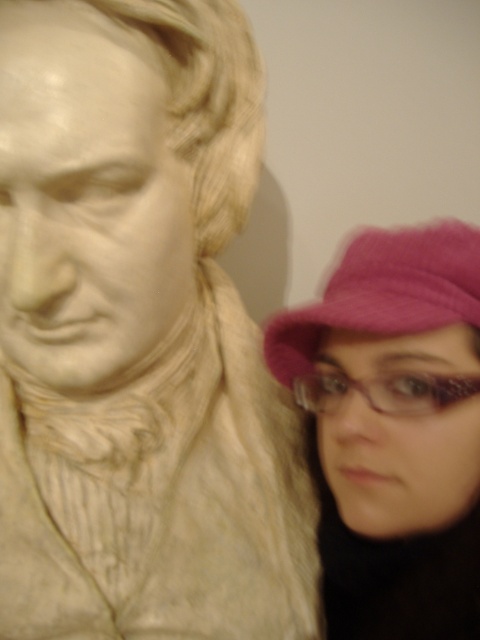
Question: Does white marble bust at upper left lie behind pink fuzzy hat at lower right?

Choices:
 (A) yes
 (B) no

Answer: (B)

Question: Considering the relative positions of pink fuzzy hat at right and pink fuzzy hat at lower right in the image provided, where is pink fuzzy hat at right located with respect to pink fuzzy hat at lower right?

Choices:
 (A) below
 (B) above

Answer: (A)

Question: Can you confirm if white marble bust at upper left is wider than pink fuzzy hat at right?

Choices:
 (A) no
 (B) yes

Answer: (B)

Question: Which object is closer to the camera taking this photo?

Choices:
 (A) pink fuzzy hat at lower right
 (B) pink fuzzy hat at right

Answer: (A)

Question: Which object is positioned farthest from the pink fuzzy hat at right?

Choices:
 (A) white marble bust at upper left
 (B) pink fuzzy hat at lower right

Answer: (A)

Question: Among these points, which one is nearest to the camera?

Choices:
 (A) (6, 337)
 (B) (296, 365)
 (C) (368, 241)

Answer: (C)